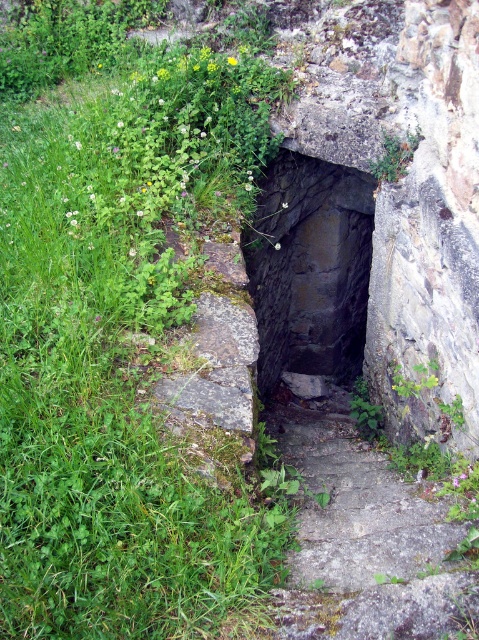
You are standing at the top of the narrow stone staircase leading into the dark enclosed space. You notice a point marked at coordinates [117,346]. What object is located at that point?

The point at coordinates [117,346] corresponds to green leafy grass at left.

You are a gardener who wants to mow the green leafy grass at left and the gray stone steps at center. Which area requires mowing first based on their height?

The green leafy grass at left requires mowing first because it has a greater height compared to the gray stone steps at center.

You are a hiker carrying a 30 cm wide backpack. You need to walk down the gray stone steps at center and the dark stone staircase at center. Which of these two will allow you to pass through without your backpack touching the sides?

The dark stone staircase at center has a greater width than the gray stone steps at center, so the backpack will fit through the dark stone staircase at center without touching the sides.